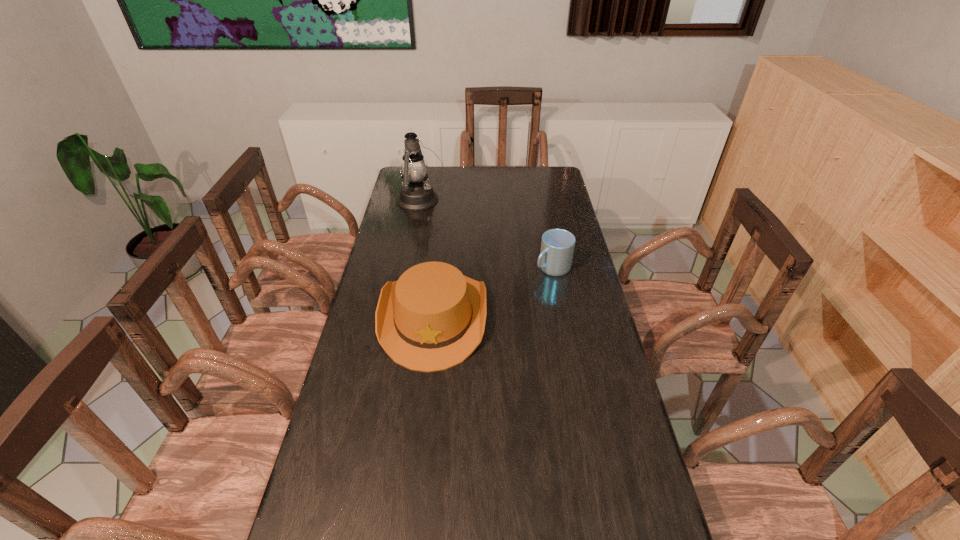
You are a GUI agent. You are given a task and a screenshot of the screen. Output one action in this format:
    pyautogui.click(x=<x>, y=<y>)
    Task: Click on the oil lamp
    Image resolution: width=960 pixels, height=540 pixels.
    Given the screenshot: What is the action you would take?
    pyautogui.click(x=415, y=194)

Locate an element on the screen. the farthest object is located at coordinates (415, 194).

The height and width of the screenshot is (540, 960). I want to click on the rightmost object, so click(557, 246).

The image size is (960, 540). In order to click on cowboy hat in this screenshot , I will do `click(432, 318)`.

Where is `blank area located on the back of the oil lamp`? This screenshot has width=960, height=540. blank area located on the back of the oil lamp is located at coordinates tap(426, 174).

Where is `vacant space located on the back of the rightmost object`? This screenshot has height=540, width=960. vacant space located on the back of the rightmost object is located at coordinates (547, 241).

The image size is (960, 540). I want to click on free space located 0.250m on the front-facing side of the cowboy hat, so click(419, 457).

Locate an element on the screen. This screenshot has height=540, width=960. object located at the far edge is located at coordinates (415, 194).

The width and height of the screenshot is (960, 540). Identify the location of oil lamp located at the left edge. (415, 194).

I want to click on cowboy hat that is at the left edge, so click(x=432, y=318).